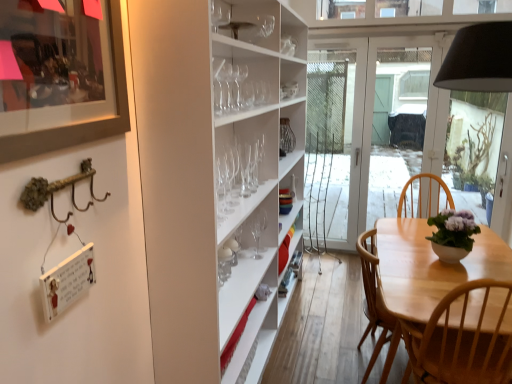
Question: Are matte black picture frame at upper left and purple matte flowerpot at center far apart?

Choices:
 (A) no
 (B) yes

Answer: (B)

Question: Can you confirm if matte black picture frame at upper left is bigger than purple matte flowerpot at center?

Choices:
 (A) yes
 (B) no

Answer: (B)

Question: Does matte black picture frame at upper left turn towards purple matte flowerpot at center?

Choices:
 (A) yes
 (B) no

Answer: (B)

Question: From a real-world perspective, is matte black picture frame at upper left on purple matte flowerpot at center?

Choices:
 (A) no
 (B) yes

Answer: (B)

Question: Is the position of matte black picture frame at upper left less distant than that of purple matte flowerpot at center?

Choices:
 (A) yes
 (B) no

Answer: (A)

Question: Based on their sizes in the image, would you say clear glass wine glass at center, the 1th wine glass positioned from the back, is bigger or smaller than matte black picture frame at upper left?

Choices:
 (A) small
 (B) big

Answer: (A)

Question: In terms of height, does clear glass wine glass at center, the 1th wine glass positioned from the back, look taller or shorter compared to matte black picture frame at upper left?

Choices:
 (A) short
 (B) tall

Answer: (A)

Question: Looking at their shapes, would you say clear glass wine glass at center, which appears as the sixth wine glass when viewed from the front, is wider or thinner than matte black picture frame at upper left?

Choices:
 (A) wide
 (B) thin

Answer: (A)

Question: From a real-world perspective, is clear glass wine glass at center, the 1th wine glass positioned from the back, above or below matte black picture frame at upper left?

Choices:
 (A) below
 (B) above

Answer: (A)

Question: Looking at the image, does clear glass wine glass at center, the second wine glass viewed from the back, seem bigger or smaller compared to transparent glass wine glass at upper center, the sixth wine glass viewed from the back?

Choices:
 (A) big
 (B) small

Answer: (B)

Question: Considering the positions of clear glass wine glass at center, the fifth wine glass positioned from the front, and transparent glass wine glass at upper center, the sixth wine glass viewed from the back, in the image, is clear glass wine glass at center, the fifth wine glass positioned from the front, wider or thinner than transparent glass wine glass at upper center, the sixth wine glass viewed from the back,?

Choices:
 (A) wide
 (B) thin

Answer: (B)

Question: Considering the positions of clear glass wine glass at center, the second wine glass viewed from the back, and transparent glass wine glass at upper center, which is the first wine glass from front to back, in the image, is clear glass wine glass at center, the second wine glass viewed from the back, taller or shorter than transparent glass wine glass at upper center, which is the first wine glass from front to back,?

Choices:
 (A) tall
 (B) short

Answer: (A)

Question: Is clear glass wine glass at center, the second wine glass viewed from the back, inside or outside of transparent glass wine glass at upper center, the sixth wine glass viewed from the back?

Choices:
 (A) outside
 (B) inside

Answer: (A)

Question: From the image's perspective, is transparent glass wine glass at upper center, which is the first wine glass from front to back, positioned above or below clear glass wine glass at center, which appears as the second wine glass when viewed from the front?

Choices:
 (A) above
 (B) below

Answer: (A)

Question: Considering the positions of transparent glass wine glass at upper center, the sixth wine glass viewed from the back, and clear glass wine glass at center, which appears as the second wine glass when viewed from the front, in the image, is transparent glass wine glass at upper center, the sixth wine glass viewed from the back, bigger or smaller than clear glass wine glass at center, which appears as the second wine glass when viewed from the front,?

Choices:
 (A) small
 (B) big

Answer: (A)